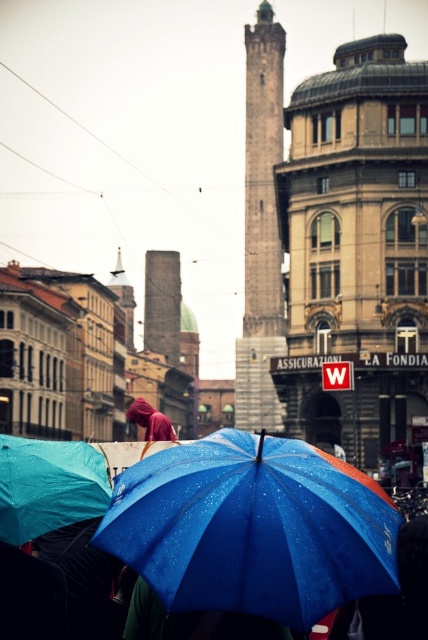
Question: Is gray stone tower at center thinner than blue matte umbrella at lower center?

Choices:
 (A) no
 (B) yes

Answer: (A)

Question: Which object is farther from the camera taking this photo?

Choices:
 (A) blue glossy umbrella at center
 (B) gray stone tower at center

Answer: (B)

Question: Which of these objects is positioned farthest from the velvet maroon hoodie at center?

Choices:
 (A) blue glossy umbrella at center
 (B) blue matte umbrella at lower center

Answer: (A)

Question: Does blue glossy umbrella at center lie in front of velvet maroon hoodie at center?

Choices:
 (A) no
 (B) yes

Answer: (B)

Question: Does blue glossy umbrella at center appear on the left side of gray stone tower at center?

Choices:
 (A) no
 (B) yes

Answer: (B)

Question: Among these points, which one is nearest to the camera?

Choices:
 (A) (53, 525)
 (B) (130, 412)

Answer: (A)